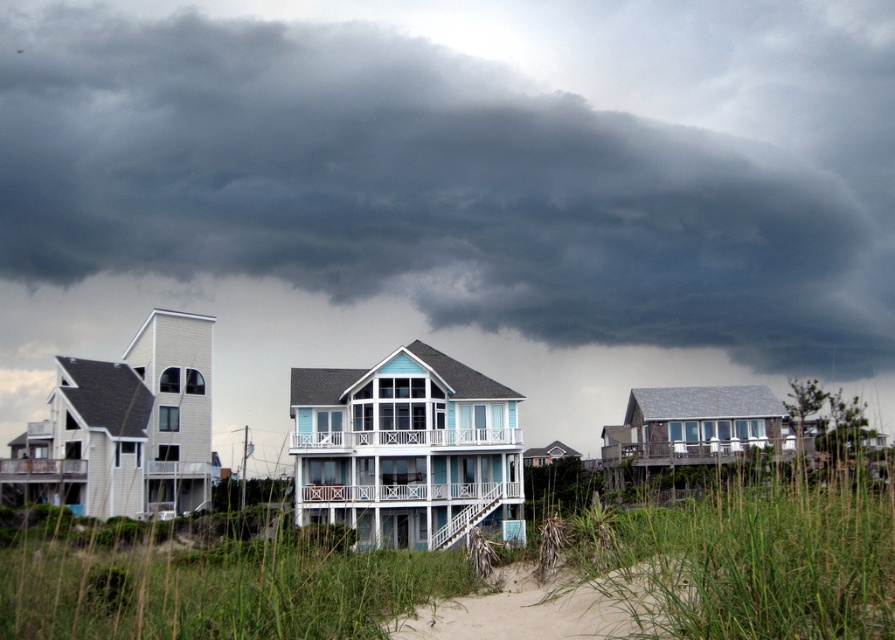
Which of these two, dark gray cloud at upper center or sandy beach at lower center, stands taller?

With more height is dark gray cloud at upper center.

Which is above, dark gray cloud at upper center or sandy beach at lower center?

dark gray cloud at upper center is above.

Which is behind, point (670, 180) or point (575, 616)?

The point (670, 180) is behind.

This screenshot has width=895, height=640. What are the coordinates of `dark gray cloud at upper center` in the screenshot? It's located at (476, 164).